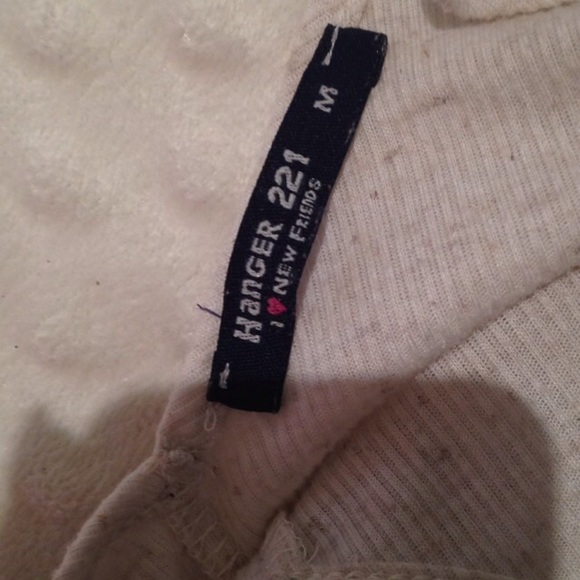
Where is `fluffy white cloth`? fluffy white cloth is located at coordinates [121, 206].